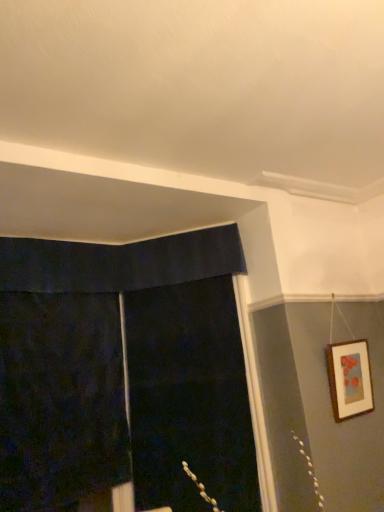
What do you see at coordinates (60, 400) in the screenshot?
I see `dark velvet curtain at left` at bounding box center [60, 400].

Find the location of a particular element. Image resolution: width=384 pixels, height=512 pixels. black fabric screen door at center is located at coordinates (189, 398).

The width and height of the screenshot is (384, 512). There is a wooden picture frame at upper right. Find the location of `screen door above it (from a real-world perspective)`. screen door above it (from a real-world perspective) is located at coordinates (189, 398).

Is wooden picture frame at upper right outside of black fabric screen door at center?

wooden picture frame at upper right is positioned outside black fabric screen door at center.

Which is in front, wooden picture frame at upper right or black fabric screen door at center?

wooden picture frame at upper right.

From the image's perspective, who appears lower, wooden picture frame at upper right or black fabric screen door at center?

black fabric screen door at center.

Is black fabric screen door at center in front of or behind wooden picture frame at upper right in the image?

black fabric screen door at center is behind wooden picture frame at upper right.

From a real-world perspective, who is located lower, black fabric screen door at center or wooden picture frame at upper right?

wooden picture frame at upper right.

In terms of height, does black fabric screen door at center look taller or shorter compared to wooden picture frame at upper right?

Considering their sizes, black fabric screen door at center has more height than wooden picture frame at upper right.

Is wooden picture frame at upper right completely or partially inside black fabric screen door at center?

No, wooden picture frame at upper right is located outside of black fabric screen door at center.

Could you tell me if dark velvet curtain at left is turned towards black fabric screen door at center?

No, dark velvet curtain at left is not facing towards black fabric screen door at center.

Is point (94, 296) closer or farther from the camera than point (235, 509)?

Point (94, 296) is farther from the camera than point (235, 509).

Considering the relative positions of dark velvet curtain at left and black fabric screen door at center in the image provided, is dark velvet curtain at left to the left or to the right of black fabric screen door at center?

Based on their positions, dark velvet curtain at left is located to the left of black fabric screen door at center.

Find the location of a particular element. screen door behind the dark velvet curtain at left is located at coordinates tap(189, 398).

Looking at this image, is wooden picture frame at upper right oriented away from dark velvet curtain at left?

wooden picture frame at upper right does not have its back to dark velvet curtain at left.

How far apart are wooden picture frame at upper right and dark velvet curtain at left?

wooden picture frame at upper right and dark velvet curtain at left are 6.09 feet apart.

From a real-world perspective, is wooden picture frame at upper right on dark velvet curtain at left?

Actually, wooden picture frame at upper right is physically below dark velvet curtain at left in the real world.

Does wooden picture frame at upper right appear on the left side of dark velvet curtain at left?

No, wooden picture frame at upper right is not to the left of dark velvet curtain at left.

Where is `curtain positioned vertically above the wooden picture frame at upper right (from a real-world perspective)`? The width and height of the screenshot is (384, 512). curtain positioned vertically above the wooden picture frame at upper right (from a real-world perspective) is located at coordinates (60, 400).

Based on the photo, who is smaller, dark velvet curtain at left or wooden picture frame at upper right?

Smaller between the two is wooden picture frame at upper right.

From the picture: Is dark velvet curtain at left completely or partially outside of wooden picture frame at upper right?

Yes.

Can you confirm if dark velvet curtain at left is positioned to the left of wooden picture frame at upper right?

Yes.

Is black fabric screen door at center closer to camera compared to dark velvet curtain at left?

No, it is not.

Does black fabric screen door at center have a smaller size compared to dark velvet curtain at left?

Indeed, black fabric screen door at center has a smaller size compared to dark velvet curtain at left.

Considering the sizes of objects black fabric screen door at center and dark velvet curtain at left in the image provided, who is taller, black fabric screen door at center or dark velvet curtain at left?

black fabric screen door at center.

The height and width of the screenshot is (512, 384). Identify the location of picture frame located underneath the black fabric screen door at center (from a real-world perspective). (349, 379).

Locate an element on the screen. screen door that is on the left side of wooden picture frame at upper right is located at coordinates (189, 398).

When comparing their distances from black fabric screen door at center, does dark velvet curtain at left or wooden picture frame at upper right seem closer?

Based on the image, dark velvet curtain at left appears to be nearer to black fabric screen door at center.

Based on their spatial positions, is black fabric screen door at center or dark velvet curtain at left further from wooden picture frame at upper right?

The object further to wooden picture frame at upper right is dark velvet curtain at left.

Looking at the image, which one is located closer to wooden picture frame at upper right, dark velvet curtain at left or black fabric screen door at center?

Based on the image, black fabric screen door at center appears to be nearer to wooden picture frame at upper right.

Estimate the real-world distances between objects in this image. Which object is further from black fabric screen door at center, wooden picture frame at upper right or dark velvet curtain at left?

wooden picture frame at upper right lies further to black fabric screen door at center than the other object.

Based on their spatial positions, is wooden picture frame at upper right or black fabric screen door at center closer to dark velvet curtain at left?

Among the two, black fabric screen door at center is located nearer to dark velvet curtain at left.

When comparing their distances from dark velvet curtain at left, does black fabric screen door at center or wooden picture frame at upper right seem further?

Among the two, wooden picture frame at upper right is located further to dark velvet curtain at left.

Where is `screen door between dark velvet curtain at left and wooden picture frame at upper right in the horizontal direction`? The height and width of the screenshot is (512, 384). screen door between dark velvet curtain at left and wooden picture frame at upper right in the horizontal direction is located at coordinates (189, 398).